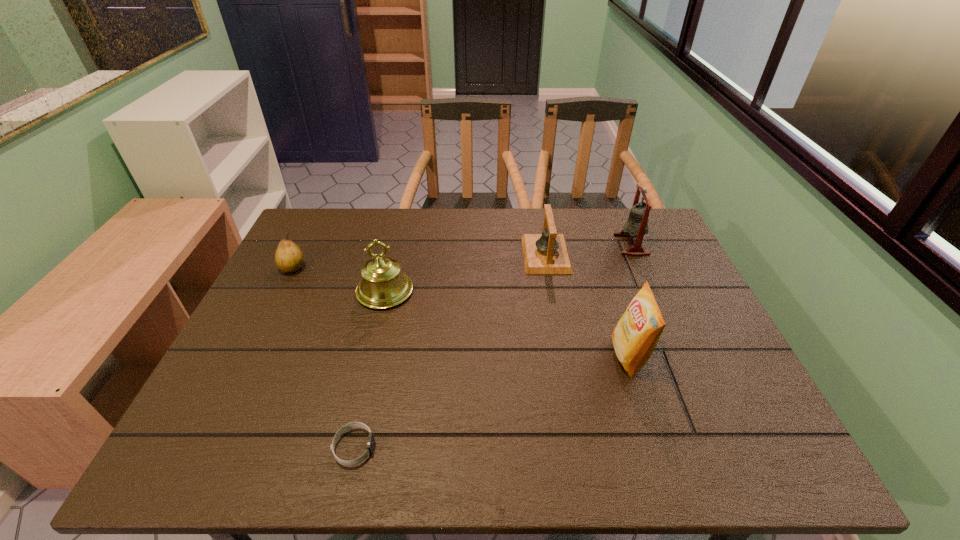
Where is `vacant point located between the fifth tallest object and the nearest object`? The width and height of the screenshot is (960, 540). vacant point located between the fifth tallest object and the nearest object is located at coordinates (324, 357).

Image resolution: width=960 pixels, height=540 pixels. I want to click on empty space that is in between the wristband and the leftmost object, so click(x=324, y=357).

Find the location of a particular element. The height and width of the screenshot is (540, 960). empty location between the leftmost bell and the nearest object is located at coordinates pyautogui.click(x=370, y=369).

Where is `vacant space that's between the second nearest object and the second bell from left to right`? vacant space that's between the second nearest object and the second bell from left to right is located at coordinates (588, 305).

Image resolution: width=960 pixels, height=540 pixels. I want to click on free space between the leftmost bell and the fourth tallest object, so [466, 273].

Locate an element on the screen. The image size is (960, 540). vacant region between the nearest object and the crisp (potato chip) is located at coordinates (492, 402).

Where is `object that is the third nearest to the fifth object from left to right`? This screenshot has width=960, height=540. object that is the third nearest to the fifth object from left to right is located at coordinates (383, 285).

Identify which object is the second closest to the fifth object from left to right. Please provide its 2D coordinates. Your answer should be formatted as a tuple, i.e. [(x, y)], where the tuple contains the x and y coordinates of a point satisfying the conditions above.

[(637, 223)]

Where is `bell object that ranks as the second closest to the crisp (potato chip)`? This screenshot has height=540, width=960. bell object that ranks as the second closest to the crisp (potato chip) is located at coordinates (637, 223).

In order to click on the closest bell to the second shortest object in this screenshot , I will do `click(383, 285)`.